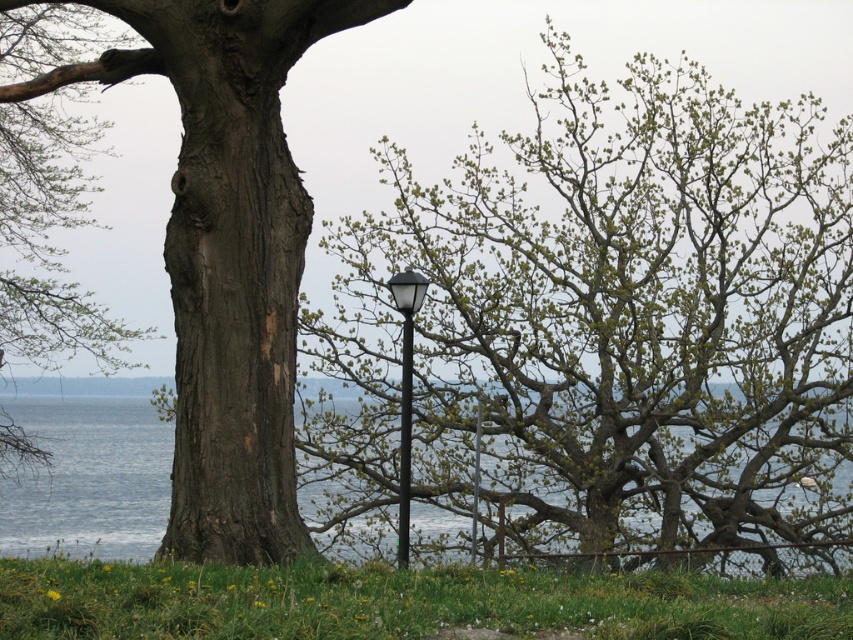
Does blue water at lower left have a greater height compared to black glass street light at center?

In fact, blue water at lower left may be shorter than black glass street light at center.

Who is taller, blue water at lower left or black glass street light at center?

With more height is black glass street light at center.

Which is in front, point (94, 448) or point (409, 284)?

Point (409, 284) is more forward.

Find the location of a particular element. The image size is (853, 640). blue water at lower left is located at coordinates (88, 472).

Which is behind, point (614, 312) or point (402, 497)?

The point (614, 312) is behind.

Can you confirm if green leafy tree at center is taller than black glass street light at center?

Correct, green leafy tree at center is much taller as black glass street light at center.

This screenshot has height=640, width=853. In order to click on green leafy tree at center in this screenshot , I will do `click(602, 324)`.

Does green leafy tree at center come in front of smooth brown tree trunk at left?

Yes, green leafy tree at center is in front of smooth brown tree trunk at left.

Image resolution: width=853 pixels, height=640 pixels. What are the coordinates of `green leafy tree at center` in the screenshot? It's located at coord(602,324).

Locate an element on the screen. green leafy tree at center is located at coordinates (602, 324).